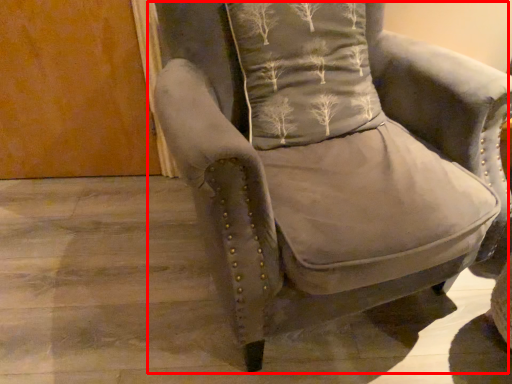
Question: Observing the image, what is the correct spatial positioning of chair (annotated by the red box) in reference to pillow?

Choices:
 (A) right
 (B) left

Answer: (A)